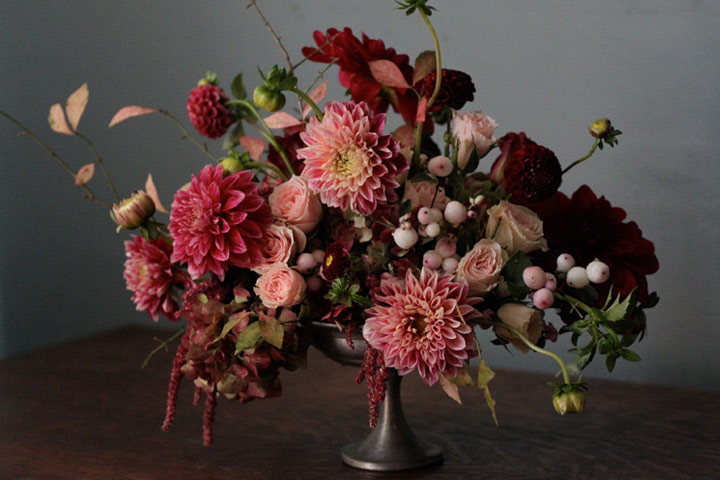
Find the location of a particular element. Image resolution: width=720 pixels, height=480 pixels. floral arrangement is located at coordinates (47, 231), (405, 261), (350, 213).